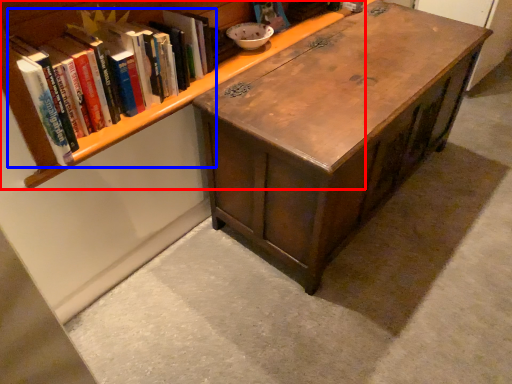
Question: Among these objects, which one is nearest to the camera, bookcase (highlighted by a red box) or book (highlighted by a blue box)?

Choices:
 (A) bookcase
 (B) book

Answer: (A)